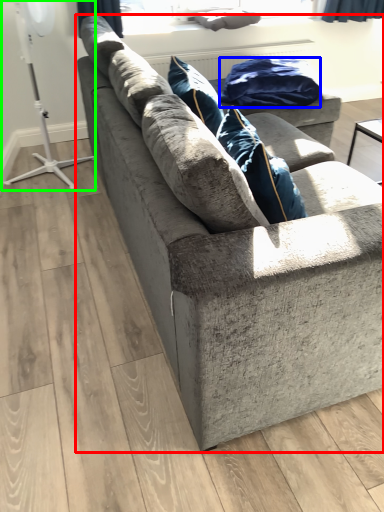
Question: Which object is the farthest from studio couch (highlighted by a red box)? Choose among these: material (highlighted by a blue box) or fan (highlighted by a green box).

Choices:
 (A) material
 (B) fan

Answer: (B)